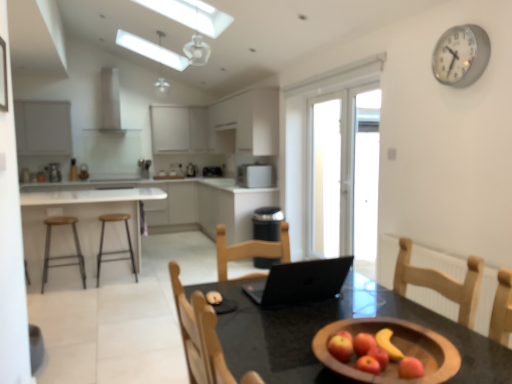
Locate an element on the screen. free space in front of wooden/metallic stool at left, arranged as the second stool when viewed from the left is located at coordinates (109, 291).